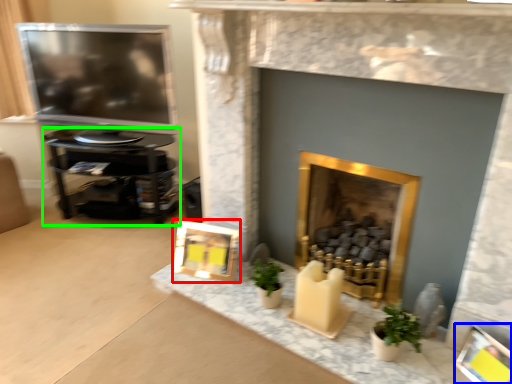
Question: Based on their relative distances, which object is nearer to picture frame (highlighted by a red box)? Choose from picture frame (highlighted by a blue box) and furniture (highlighted by a green box).

Choices:
 (A) picture frame
 (B) furniture

Answer: (B)